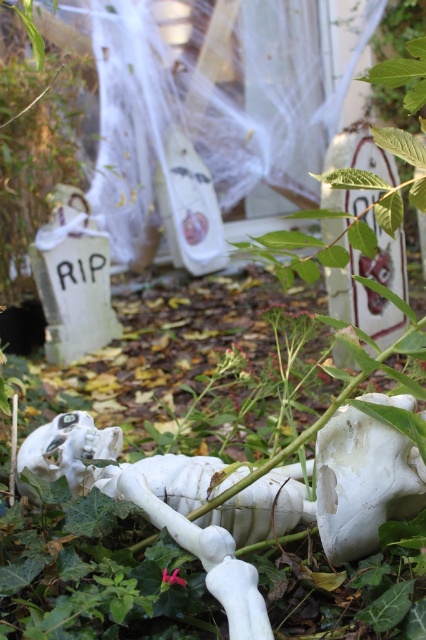
Question: Does white matte skull at lower center have a greater width compared to white matte skull at center?

Choices:
 (A) no
 (B) yes

Answer: (A)

Question: Which point appears farthest from the camera in this image?

Choices:
 (A) (32, 451)
 (B) (340, 458)

Answer: (A)

Question: Which point appears farthest from the camera in this image?

Choices:
 (A) (57, 433)
 (B) (348, 502)

Answer: (A)

Question: From the image, what is the correct spatial relationship of white matte skull at lower center in relation to white matte skull at center?

Choices:
 (A) above
 (B) below

Answer: (A)

Question: Can you confirm if white matte skull at lower center is positioned below white matte skull at center?

Choices:
 (A) yes
 (B) no

Answer: (B)